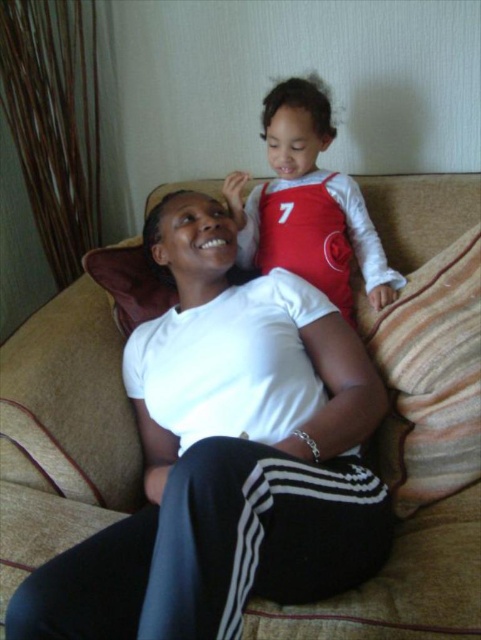
Question: In this image, where is beige fabric couch at center located relative to matte red jersey at upper center?

Choices:
 (A) below
 (B) above

Answer: (A)

Question: Which object appears closest to the camera in this image?

Choices:
 (A) beige fabric couch at center
 (B) matte red jersey at upper center

Answer: (A)

Question: Which of the following is the closest to the observer?

Choices:
 (A) beige fabric couch at center
 (B) matte red jersey at upper center

Answer: (A)

Question: Considering the relative positions of beige fabric couch at center and matte red jersey at upper center in the image provided, where is beige fabric couch at center located with respect to matte red jersey at upper center?

Choices:
 (A) below
 (B) above

Answer: (A)

Question: Can you confirm if beige fabric couch at center is thinner than matte red jersey at upper center?

Choices:
 (A) no
 (B) yes

Answer: (A)